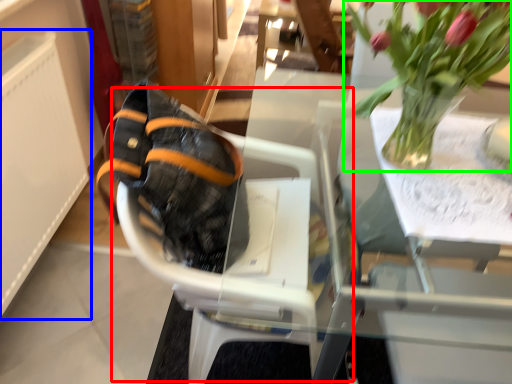
Question: Which is nearer to the baby carriage (highlighted by a red box)? radiator (highlighted by a blue box) or houseplant (highlighted by a green box).

Choices:
 (A) radiator
 (B) houseplant

Answer: (B)